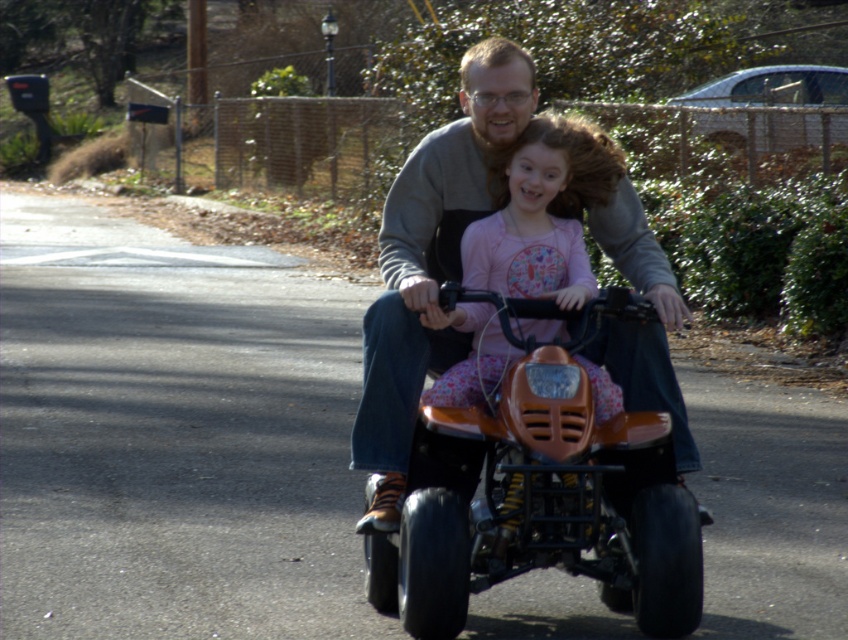
Is point (397, 182) farther from viewer compared to point (483, 248)?

Yes, point (397, 182) is behind point (483, 248).

Image resolution: width=848 pixels, height=640 pixels. In order to click on matte gray sweatshirt at center in this screenshot , I will do `click(431, 259)`.

Does point (388, 314) come closer to viewer compared to point (466, 273)?

Yes, it is in front of point (466, 273).

At what (x,y) coordinates should I click in order to perform the action: click on matte gray sweatshirt at center. Please return your answer as a coordinate pair (x, y). Looking at the image, I should click on (431, 259).